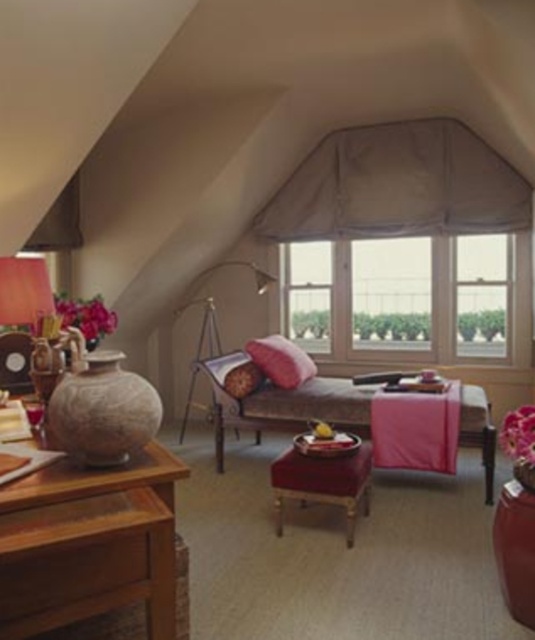
Question: Does velvet red stool at center appear on the right side of metallic gold floor lamp at center?

Choices:
 (A) yes
 (B) no

Answer: (A)

Question: Which object is positioned farthest from the wooden window at center?

Choices:
 (A) pink fabric couch at center
 (B) velvet red stool at center

Answer: (B)

Question: Does metallic gold floor lamp at center lie behind matte pink pillow at center?

Choices:
 (A) no
 (B) yes

Answer: (B)

Question: Considering the real-world distances, which object is closest to the matte brown armchair at left?

Choices:
 (A) matte pink pillow at center
 (B) pink fabric couch at center
 (C) wooden table at left

Answer: (C)

Question: Which of the following is the farthest from the observer?

Choices:
 (A) (219, 339)
 (B) (26, 388)

Answer: (A)

Question: Is pink fabric couch at center to the left of metallic gold floor lamp at center from the viewer's perspective?

Choices:
 (A) yes
 (B) no

Answer: (B)